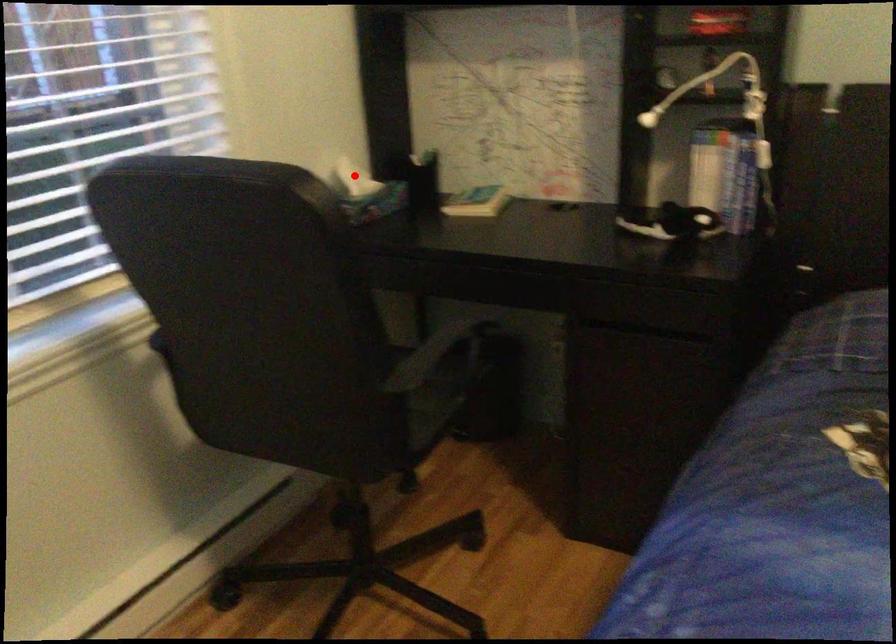
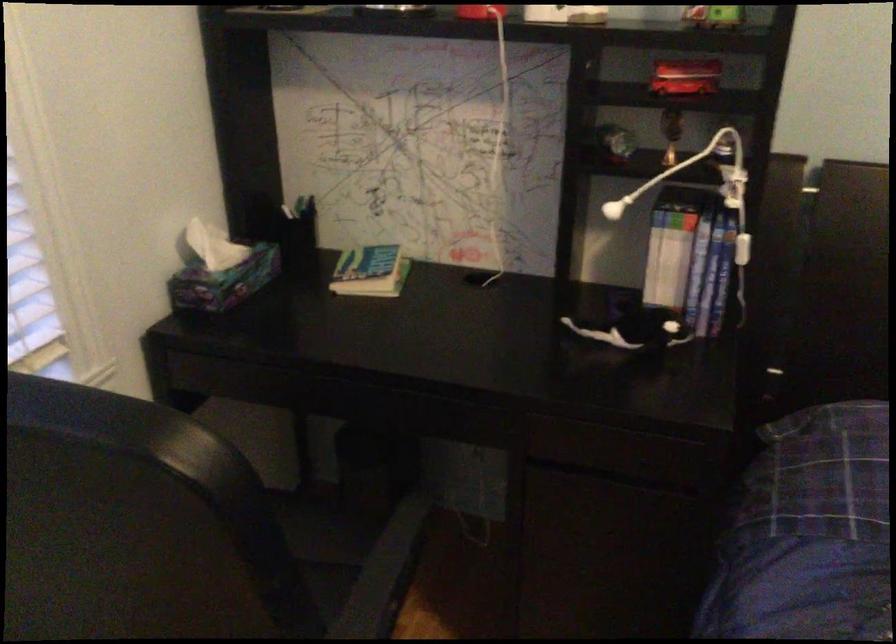
In the second image, find the point that corresponds to the highlighted location in the first image.

(213, 245)